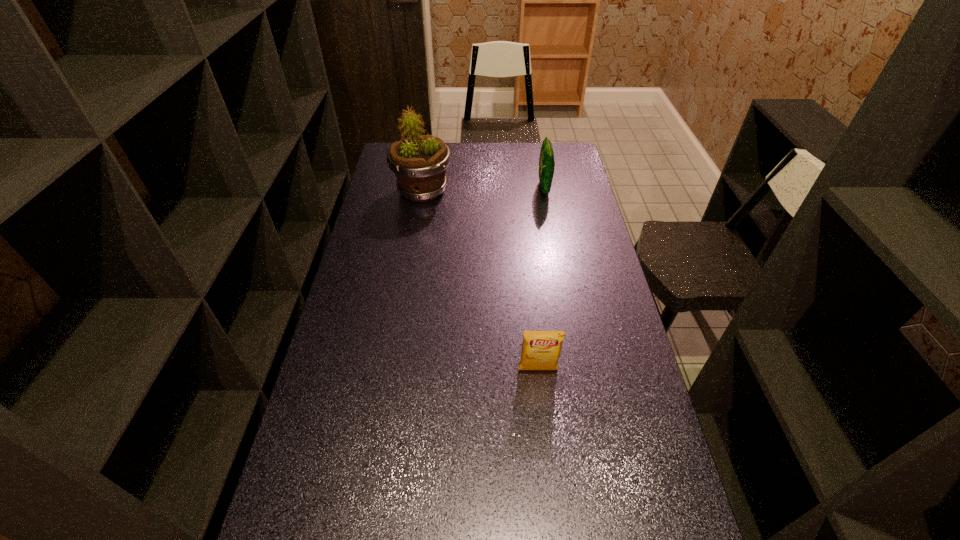
The width and height of the screenshot is (960, 540). I want to click on the tallest object, so click(x=419, y=162).

This screenshot has height=540, width=960. Identify the location of the leftmost object. (419, 162).

At what (x,y) coordinates should I click in order to perform the action: click on the right crisp (potato chip). Please return your answer as a coordinate pair (x, y). This screenshot has width=960, height=540. Looking at the image, I should click on click(546, 160).

Locate an element on the screen. The height and width of the screenshot is (540, 960). the rightmost object is located at coordinates (546, 160).

You are a GUI agent. You are given a task and a screenshot of the screen. Output one action in this format:
    pyautogui.click(x=<x>, y=<y>)
    Task: Click on the second object from left to right
    
    Given the screenshot: What is the action you would take?
    pyautogui.click(x=540, y=349)

Locate an element on the screen. The height and width of the screenshot is (540, 960). the nearer crisp (potato chip) is located at coordinates [x=540, y=349].

You are a GUI agent. You are given a task and a screenshot of the screen. Output one action in this format:
    pyautogui.click(x=<x>, y=<y>)
    Task: Click on the vacant space located on the right of the flowerpot
    
    Given the screenshot: What is the action you would take?
    pyautogui.click(x=506, y=191)

Identify the location of vacant space positioned 0.280m on the front-facing side of the farther crisp (potato chip). This screenshot has height=540, width=960. (472, 188).

At what (x,y) coordinates should I click in order to perform the action: click on free space located 0.200m on the front-facing side of the farther crisp (potato chip). Please return your answer as a coordinate pair (x, y). This screenshot has height=540, width=960. Looking at the image, I should click on (491, 188).

Identify the location of vacant space situated 0.100m on the front-facing side of the farther crisp (potato chip). This screenshot has height=540, width=960. (515, 188).